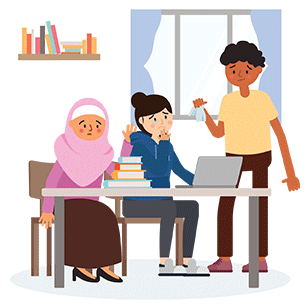
Identify the location of blue curtains (open). The height and width of the screenshot is (306, 306). (138, 33), (275, 94).